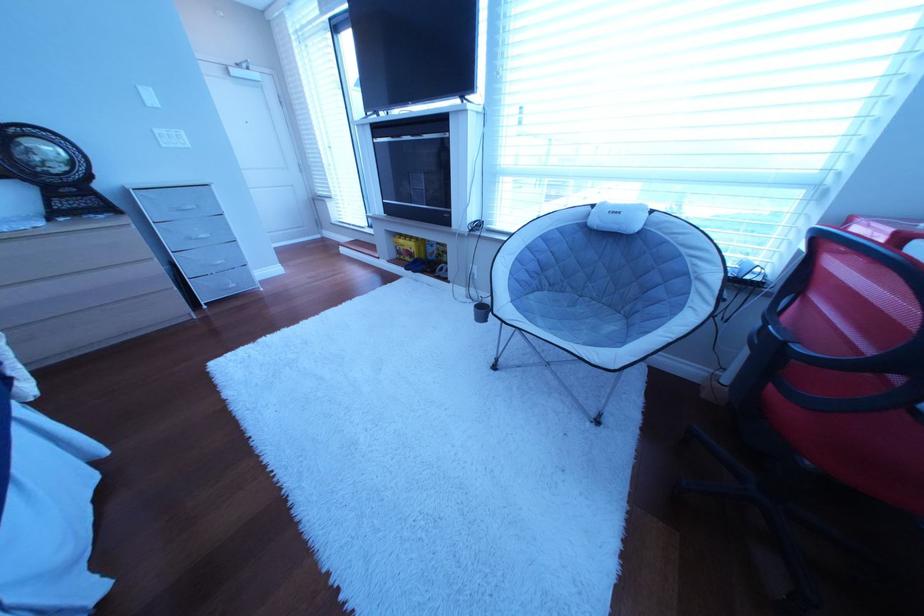
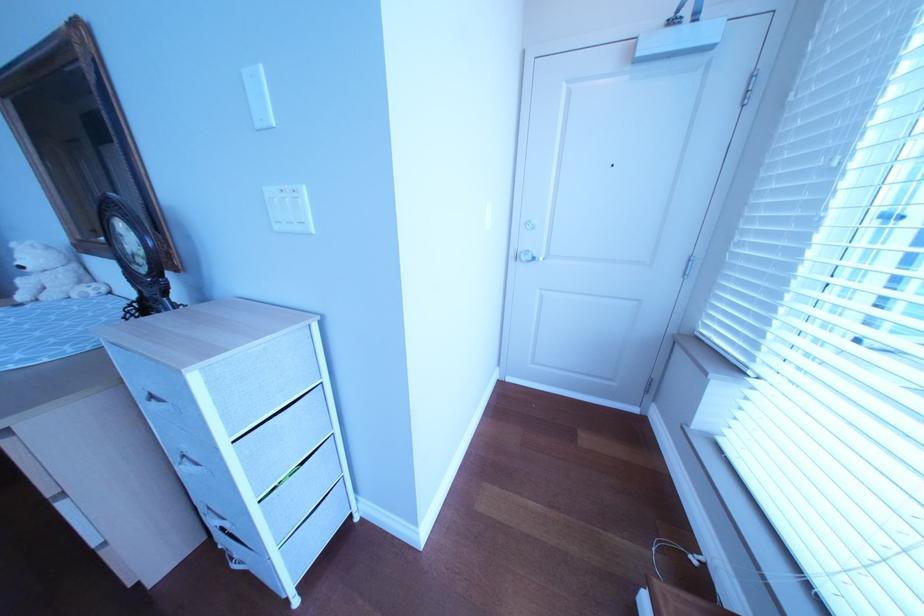
Locate, in the second image, the point that corresponds to (179,148) in the first image.

(292, 229)